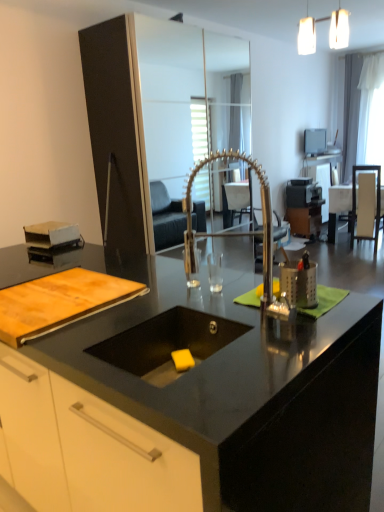
This screenshot has width=384, height=512. In order to click on free location in front of polished metallic faucet at center in this screenshot , I will do `click(251, 357)`.